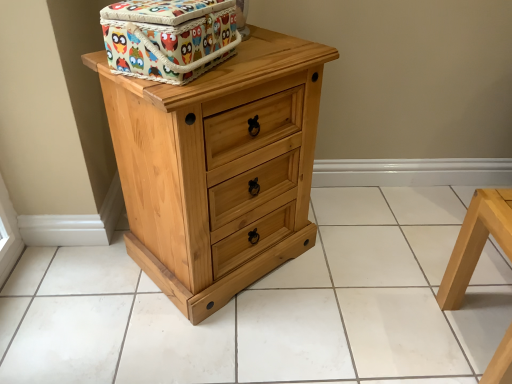
This screenshot has height=384, width=512. I want to click on free space above natural wood chest of drawers at center (from a real-world perspective), so click(257, 54).